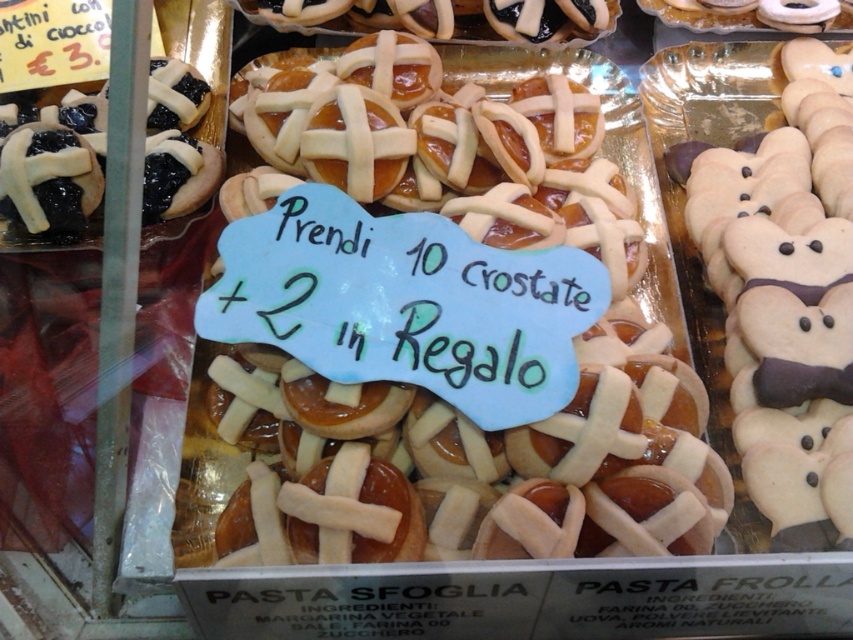
Question: Which point is closer to the camera taking this photo?

Choices:
 (A) (473, 26)
 (B) (842, 28)
 (C) (4, 198)

Answer: (C)

Question: Does glazed sugar-coated pastry at upper center lie in front of matte white cookie at upper right?

Choices:
 (A) no
 (B) yes

Answer: (B)

Question: Which point is farther to the camera?

Choices:
 (A) matte white cookie at upper right
 (B) matte black pastry at upper left
 (C) white fondant bear at right
 (D) glazed sugar-coated pastry at upper center

Answer: (A)

Question: Is matte black pastry at upper left above matte white cookie at upper right?

Choices:
 (A) no
 (B) yes

Answer: (A)

Question: Can you confirm if matte black pastry at upper left is positioned below matte white cookie at upper right?

Choices:
 (A) yes
 (B) no

Answer: (A)

Question: Considering the real-world distances, which object is closest to the white fondant bear at right?

Choices:
 (A) matte black pastry at upper left
 (B) glazed sugar-coated pastry at upper center
 (C) matte white cookie at upper right

Answer: (C)